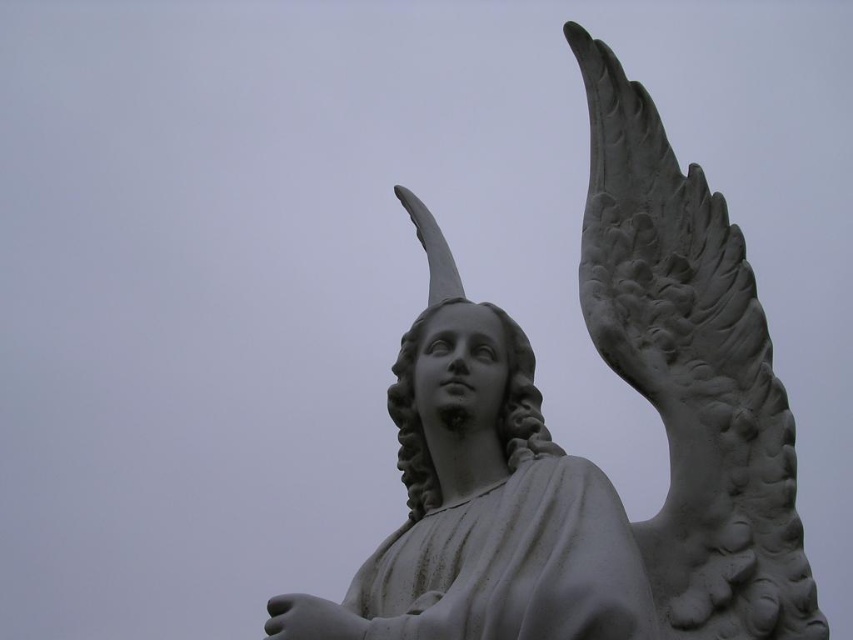
Question: From the image, what is the correct spatial relationship of white stone wing at upper right in relation to white stone statue at center?

Choices:
 (A) below
 (B) above

Answer: (B)

Question: Is the position of white stone wing at upper right less distant than that of white stone statue at center?

Choices:
 (A) yes
 (B) no

Answer: (A)

Question: Which object is closer to the camera taking this photo?

Choices:
 (A) white stone statue at center
 (B) white stone wing at upper right

Answer: (B)

Question: Which point is closer to the camera?

Choices:
 (A) white stone statue at center
 (B) white stone wing at upper right

Answer: (B)

Question: Does white stone wing at upper right have a lesser width compared to white stone statue at center?

Choices:
 (A) yes
 (B) no

Answer: (A)